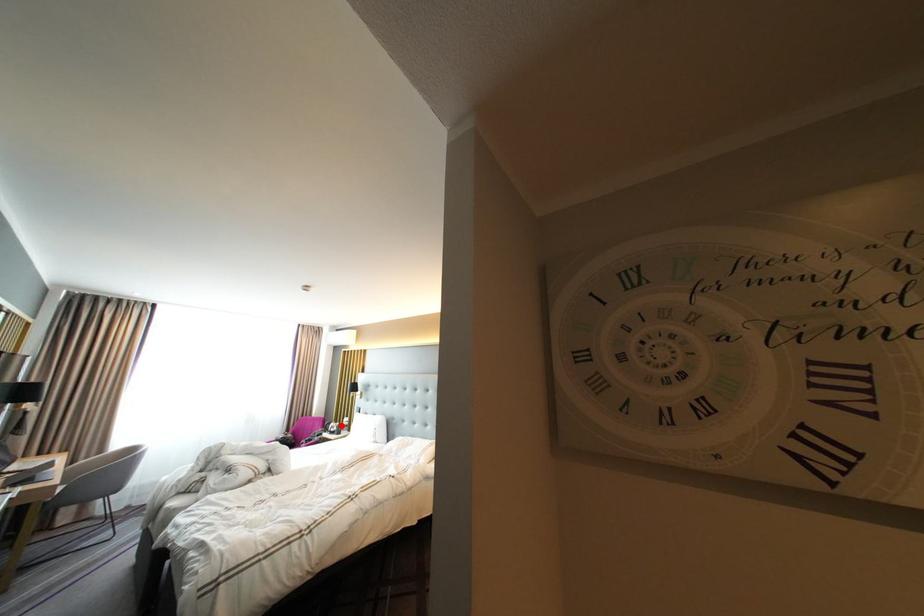
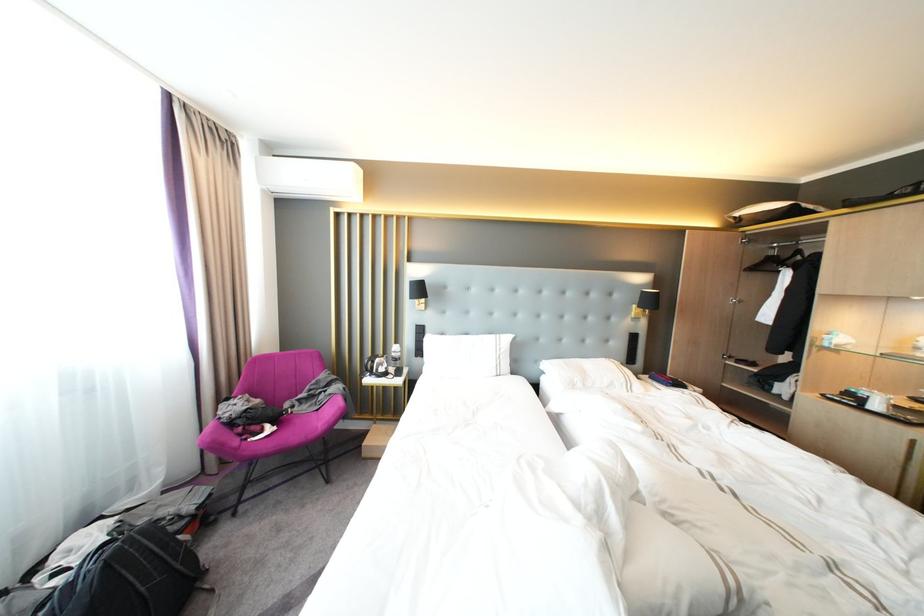
Question: I am providing you with two images of the same scene from different viewpoints. Given a red point in image1, look at the same physical point in image2. Is it:

Choices:
 (A) Closer to the viewpoint
 (B) Farther from the viewpoint

Answer: (A)